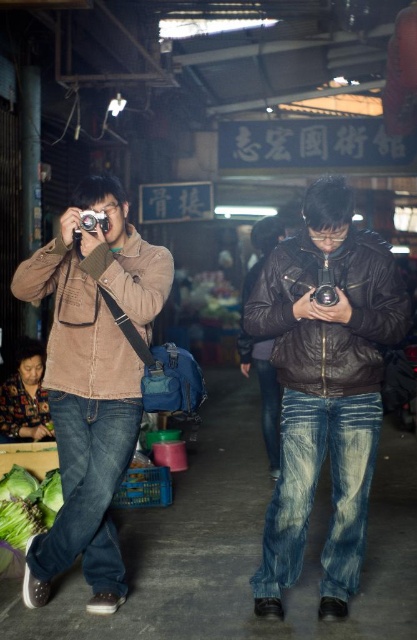
Question: Which object is closer to the camera taking this photo?

Choices:
 (A) matte black camera at left
 (B) matte brown jacket at left

Answer: (B)

Question: Does matte brown jacket at left have a greater width compared to matte black camera at left?

Choices:
 (A) no
 (B) yes

Answer: (B)

Question: Considering the relative positions of green leafy vegetable at lower left and black plastic camera at center in the image provided, where is green leafy vegetable at lower left located with respect to black plastic camera at center?

Choices:
 (A) below
 (B) above

Answer: (A)

Question: Which object is positioned farthest from the matte black jacket at center?

Choices:
 (A) green leafy vegetable at lower left
 (B) matte black camera at left
 (C) black plastic camera at center

Answer: (A)

Question: Which object is closer to the camera taking this photo?

Choices:
 (A) matte black jacket at center
 (B) green leafy vegetable at lower left

Answer: (A)

Question: Where is green leafy vegetable at lower left located in relation to black plastic camera at center in the image?

Choices:
 (A) left
 (B) right

Answer: (A)